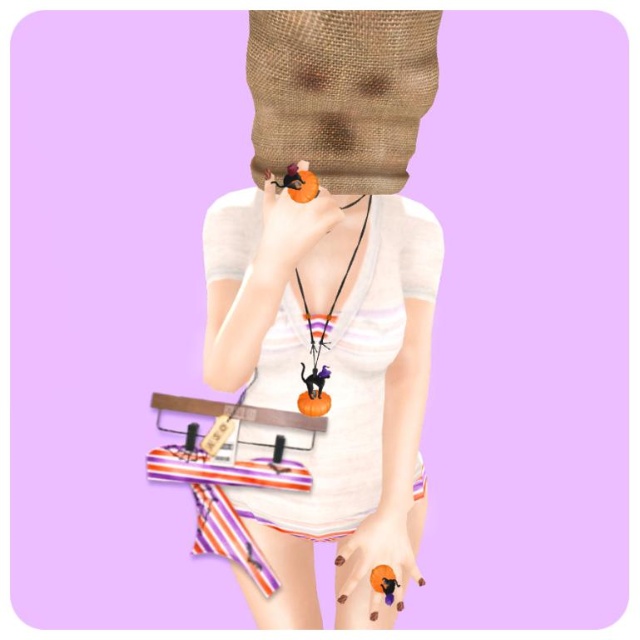
Does matte white shirt at center appear under matte orange ring at lower center?

No.

Image resolution: width=640 pixels, height=640 pixels. Describe the element at coordinates (333, 300) in the screenshot. I see `matte white shirt at center` at that location.

This screenshot has width=640, height=640. What are the coordinates of `matte white shirt at center` in the screenshot? It's located at (333, 300).

Where is `matte white shirt at center`? The width and height of the screenshot is (640, 640). matte white shirt at center is located at coordinates (333, 300).

Can you confirm if matte orange ring at lower center is thinner than matte orange ring at center?

No.

Does point (392, 524) lie in front of point (266, 195)?

No, (392, 524) is behind (266, 195).

The width and height of the screenshot is (640, 640). In order to click on matte orange ring at lower center in this screenshot , I will do `click(378, 557)`.

Is matte orange ring at lower center to the right of matte black cat at center from the viewer's perspective?

Correct, you'll find matte orange ring at lower center to the right of matte black cat at center.

Is matte orange ring at lower center in front of matte black cat at center?

No, matte orange ring at lower center is further to the viewer.

Who is more forward, (376, 596) or (312, 394)?

Point (312, 394) is more forward.

Image resolution: width=640 pixels, height=640 pixels. What are the coordinates of `matte orange ring at lower center` in the screenshot? It's located at (378, 557).